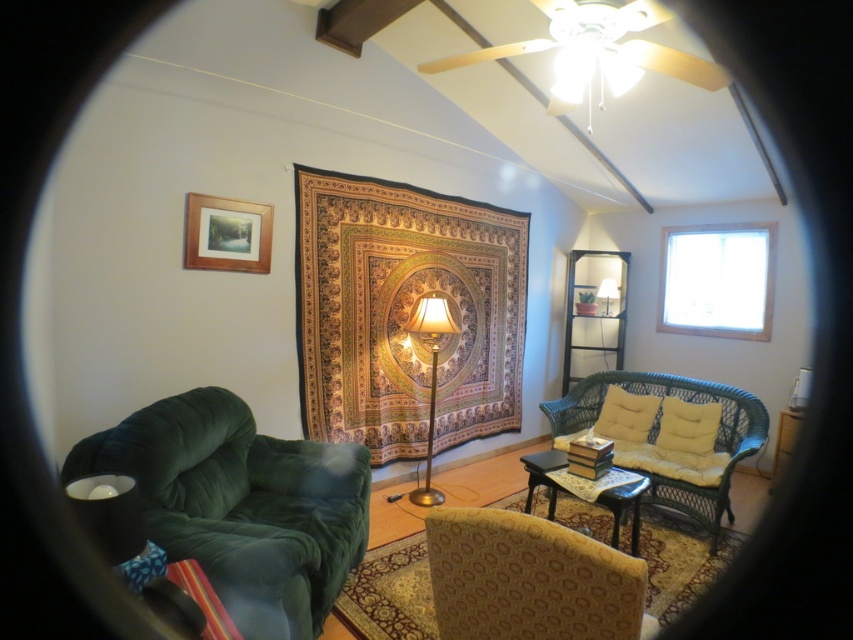
Between patterned fabric armchair at center and wooden table at center, which one appears on the left side from the viewer's perspective?

patterned fabric armchair at center

Measure the distance between point (604,620) and camera.

They are 4.06 feet apart.

Find the location of a particular element. Image resolution: width=853 pixels, height=640 pixels. patterned fabric armchair at center is located at coordinates (529, 579).

Is multicolored woven tapestry at center to the left of velvet green armchair at left from the viewer's perspective?

In fact, multicolored woven tapestry at center is to the right of velvet green armchair at left.

Who is positioned more to the left, multicolored woven tapestry at center or velvet green armchair at left?

velvet green armchair at left is more to the left.

Find the location of a particular element. multicolored woven tapestry at center is located at coordinates (404, 312).

Between point (126, 420) and point (601, 292), which one is positioned in front?

Point (126, 420) is more forward.

Is point (326, 563) behind point (613, 291)?

No, it is not.

The image size is (853, 640). I want to click on velvet green armchair at left, so click(x=242, y=506).